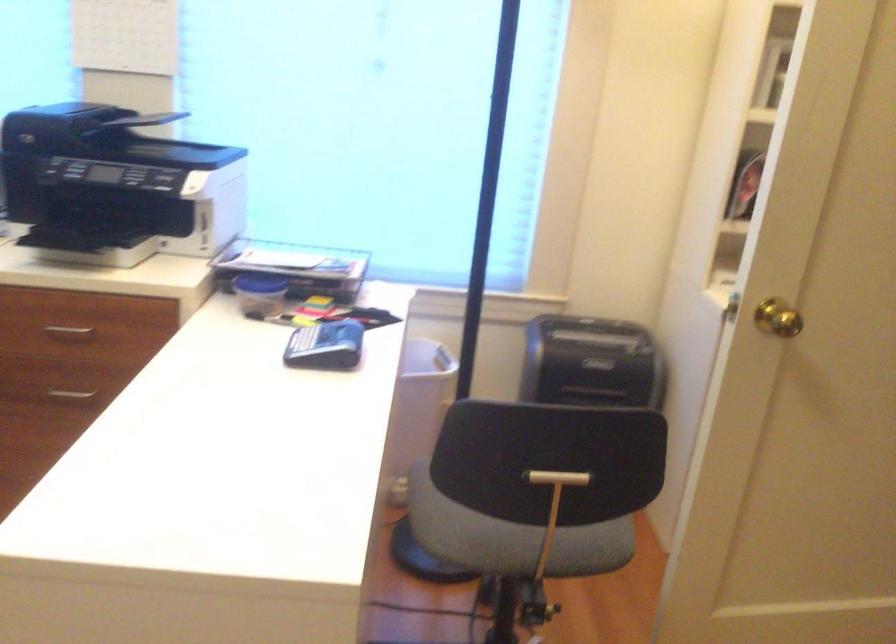
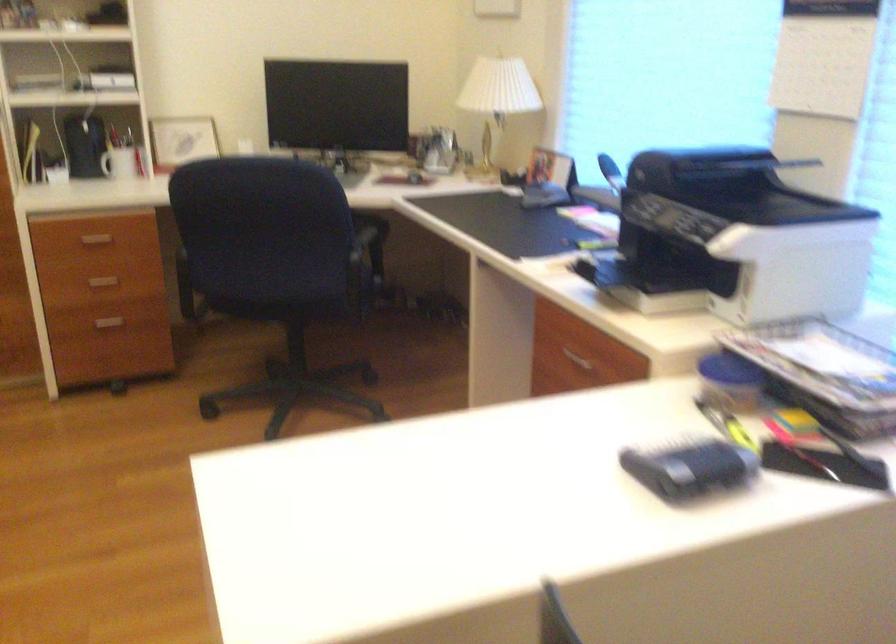
Question: The camera is either moving clockwise (left) or counter-clockwise (right) around the object. The first image is from the beginning of the video and the second image is from the end. Is the camera moving left or right when shooting the video?

Choices:
 (A) Left
 (B) Right

Answer: (B)